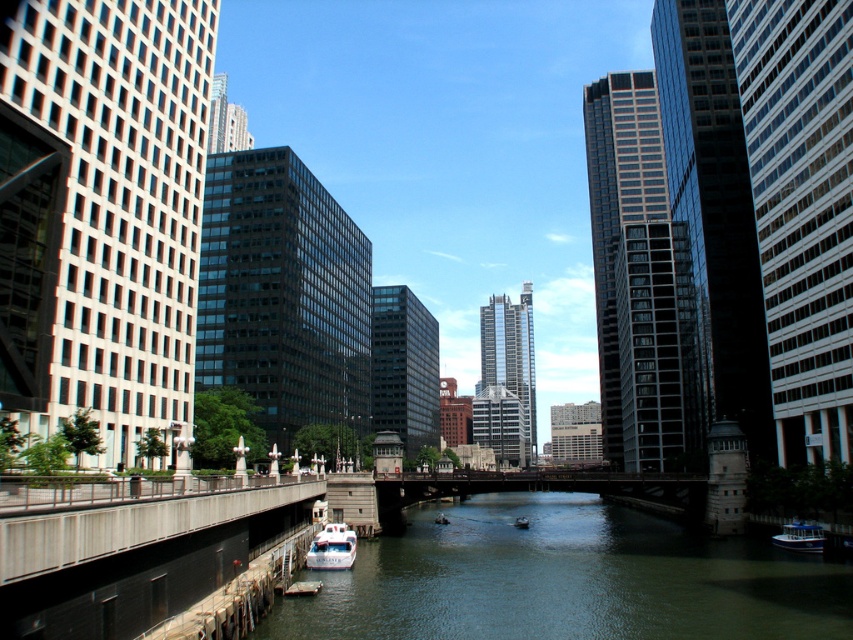
Can you confirm if white glossy boat at lower right is shorter than white plastic boat at center?

Indeed, white glossy boat at lower right has a lesser height compared to white plastic boat at center.

Can you confirm if white glossy boat at lower right is taller than white plastic boat at center?

No, white glossy boat at lower right is not taller than white plastic boat at center.

Between point (780, 538) and point (526, 528), which one is positioned in front?

Point (780, 538)

Find the location of a particular element. white glossy boat at lower right is located at coordinates (799, 536).

Does white glossy boat at lower center have a lesser height compared to white plastic boat at center?

Yes, white glossy boat at lower center is shorter than white plastic boat at center.

Describe the element at coordinates (332, 547) in the screenshot. The image size is (853, 640). I see `white glossy boat at lower center` at that location.

You are a GUI agent. You are given a task and a screenshot of the screen. Output one action in this format:
    pyautogui.click(x=<x>, y=<y>)
    Task: Click on the white glossy boat at lower center
    Image resolution: width=853 pixels, height=640 pixels.
    Given the screenshot: What is the action you would take?
    pyautogui.click(x=332, y=547)

How far apart are white glossy boat at lower center and white glossy boat at lower right?

A distance of 38.53 meters exists between white glossy boat at lower center and white glossy boat at lower right.

Who is positioned more to the right, white glossy boat at lower center or white glossy boat at lower right?

Positioned to the right is white glossy boat at lower right.

Is point (321, 536) positioned behind point (801, 534)?

No.

Locate an element on the screen. The height and width of the screenshot is (640, 853). white glossy boat at lower center is located at coordinates (332, 547).